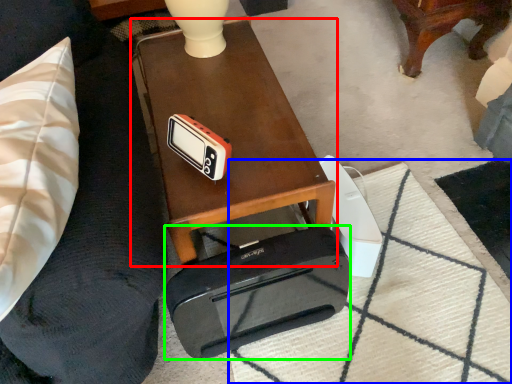
Question: Which object is positioned closest to table (highlighted by a red box)? Select from mat (highlighted by a blue box) and cassette (highlighted by a green box).

Choices:
 (A) mat
 (B) cassette

Answer: (B)